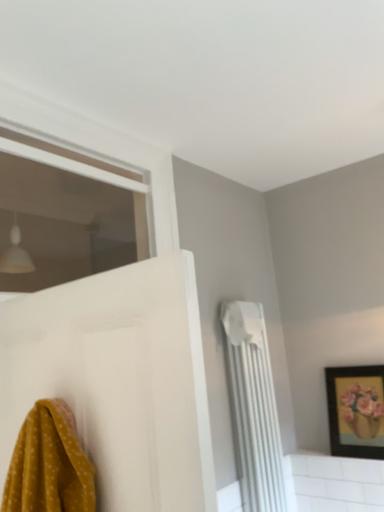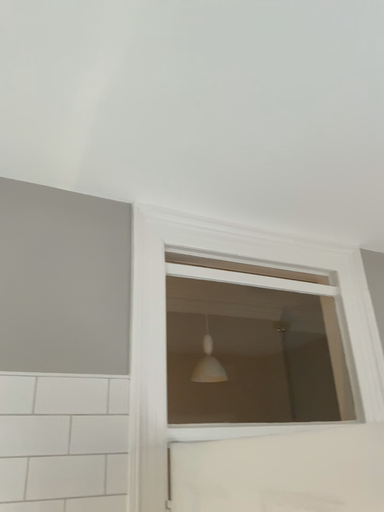
Question: How did the camera likely rotate when shooting the video?

Choices:
 (A) rotated upward
 (B) rotated downward

Answer: (A)